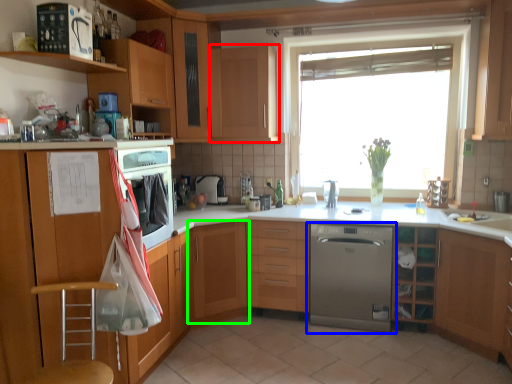
Question: Which is farther away from cabinetry (highlighted by a red box)? home appliance (highlighted by a blue box) or cabinetry (highlighted by a green box)?

Choices:
 (A) home appliance
 (B) cabinetry

Answer: (A)